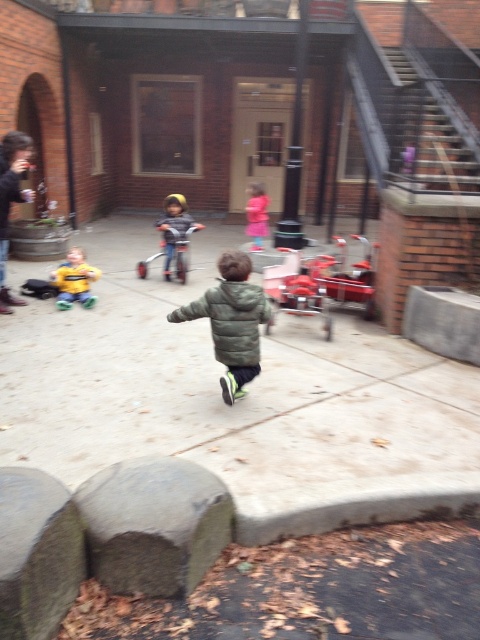
Who is positioned more to the left, green fuzzy jacket at center or matte blue helmet at center?

matte blue helmet at center

Measure the distance between green fuzzy jacket at center and camera.

3.74 meters

Where is `green fuzzy jacket at center`? green fuzzy jacket at center is located at coordinates [x=231, y=321].

Does point (170, 216) come behind point (264, 211)?

No.

Between matte blue helmet at center and pink fabric toddler at center, which one is positioned lower?

matte blue helmet at center is below.

Does point (167, 244) come in front of point (259, 230)?

Yes, it is.

This screenshot has height=640, width=480. I want to click on matte blue helmet at center, so click(172, 227).

Does green fuzzy jacket at center lie in front of pink fabric toddler at center?

Yes, it is in front of pink fabric toddler at center.

Does green fuzzy jacket at center have a smaller size compared to pink fabric toddler at center?

Incorrect, green fuzzy jacket at center is not smaller in size than pink fabric toddler at center.

Where is `green fuzzy jacket at center`? green fuzzy jacket at center is located at coordinates pos(231,321).

Find the location of `green fuzzy jacket at center`. green fuzzy jacket at center is located at coordinates (231, 321).